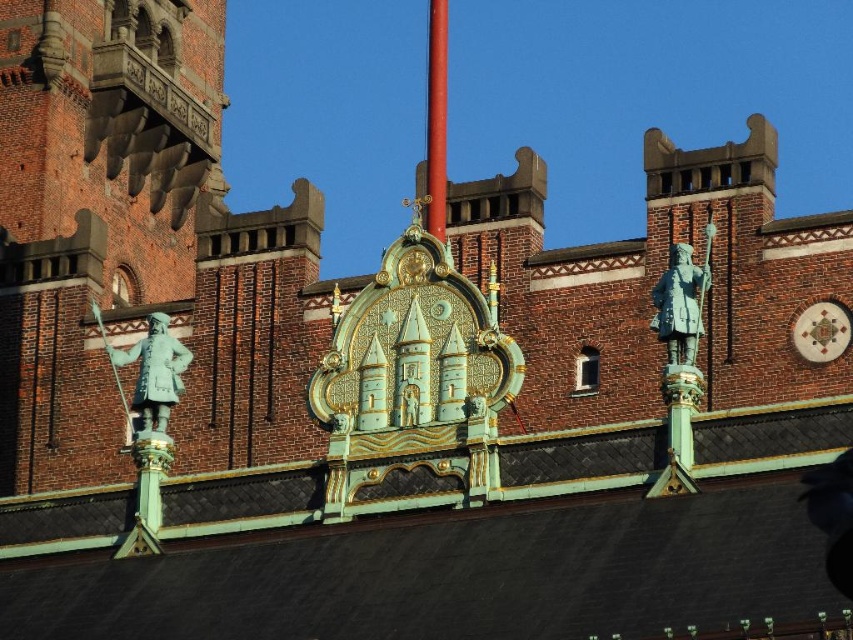
Based on the photo, is green patina statue at upper right above red polished metal pole at center?

Actually, green patina statue at upper right is below red polished metal pole at center.

Measure the distance from green patina statue at upper right to red polished metal pole at center.

green patina statue at upper right is 20.91 meters from red polished metal pole at center.

Is point (701, 298) in front of point (434, 108)?

Yes, point (701, 298) is closer to viewer.

At what (x,y) coordinates should I click in order to perform the action: click on green patina statue at upper right. Please return your answer as a coordinate pair (x, y). This screenshot has height=640, width=853. Looking at the image, I should click on (682, 301).

Between green patina statue at left and red polished metal pole at center, which one has more height?

red polished metal pole at center

Can you confirm if green patina statue at left is positioned below red polished metal pole at center?

Yes.

What are the coordinates of `green patina statue at left` in the screenshot? It's located at (154, 372).

Who is more distant from viewer, (155, 321) or (689, 296)?

The point (155, 321) is behind.

Which is more to the left, green patina statue at left or green patina statue at upper right?

green patina statue at left is more to the left.

Describe the element at coordinates (154, 372) in the screenshot. This screenshot has width=853, height=640. I see `green patina statue at left` at that location.

At what (x,y) coordinates should I click in order to perform the action: click on green patina statue at left. Please return your answer as a coordinate pair (x, y). The height and width of the screenshot is (640, 853). Looking at the image, I should click on tap(154, 372).